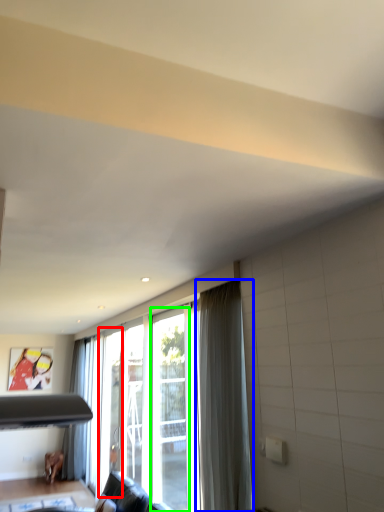
Question: Estimate the real-world distances between objects in this image. Which object is closer to screen door (highlighted by a red box), curtain (highlighted by a blue box) or screen door (highlighted by a green box)?

Choices:
 (A) curtain
 (B) screen door

Answer: (B)